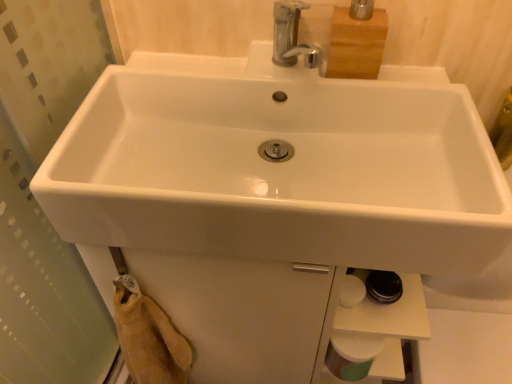
The image size is (512, 384). In order to click on white glossy sink at center in this screenshot , I will do [280, 172].

This screenshot has width=512, height=384. What do you see at coordinates (280, 172) in the screenshot? I see `white glossy sink at center` at bounding box center [280, 172].

The image size is (512, 384). I want to click on white matte toilet paper at lower right, so click(352, 356).

In order to face white matte toilet paper at lower right, should I rotate leftwards or rightwards?

A 12.710 degree turn to the right will do.

What do you see at coordinates (352, 356) in the screenshot? The width and height of the screenshot is (512, 384). I see `white matte toilet paper at lower right` at bounding box center [352, 356].

What is the approximate width of white matte toilet paper at lower right?

The width of white matte toilet paper at lower right is 3.39 inches.

Locate an element on the screen. white glossy sink at center is located at coordinates (280, 172).

Which object is positioned more to the right, white glossy sink at center or white matte toilet paper at lower right?

Positioned to the right is white matte toilet paper at lower right.

Which object is closer to the camera taking this photo, white glossy sink at center or white matte toilet paper at lower right?

white glossy sink at center is closer to the camera.

Considering the positions of points (222, 250) and (343, 335), is point (222, 250) farther from camera compared to point (343, 335)?

No, (222, 250) is in front of (343, 335).

From the image's perspective, relative to white matte toilet paper at lower right, is white glossy sink at center above or below?

white glossy sink at center is above white matte toilet paper at lower right.

From a real-world perspective, is white glossy sink at center positioned above or below white matte toilet paper at lower right?

From a real-world perspective, white glossy sink at center is physically above white matte toilet paper at lower right.

Does white glossy sink at center have a greater width compared to white matte toilet paper at lower right?

Indeed, white glossy sink at center has a greater width compared to white matte toilet paper at lower right.

Does white glossy sink at center have a greater height compared to white matte toilet paper at lower right?

Indeed, white glossy sink at center has a greater height compared to white matte toilet paper at lower right.

Considering the relative sizes of white glossy sink at center and white matte toilet paper at lower right in the image provided, is white glossy sink at center bigger than white matte toilet paper at lower right?

Yes, white glossy sink at center is bigger than white matte toilet paper at lower right.

Is white glossy sink at center not within white matte toilet paper at lower right?

Indeed, white glossy sink at center is completely outside white matte toilet paper at lower right.

Is there a large distance between white glossy sink at center and white matte toilet paper at lower right?

white glossy sink at center is near white matte toilet paper at lower right, not far away.

Could you tell me if white glossy sink at center is turned towards white matte toilet paper at lower right?

No, white glossy sink at center does not turn towards white matte toilet paper at lower right.

What's the angular difference between white glossy sink at center and white matte toilet paper at lower right's facing directions?

1.33 degrees.

I want to click on toilet paper on the right of white glossy sink at center, so click(352, 356).

In the image, is white matte toilet paper at lower right on the left side or the right side of white glossy sink at center?

From the image, it's evident that white matte toilet paper at lower right is to the right of white glossy sink at center.

Between white matte toilet paper at lower right and white glossy sink at center, which one is positioned in front?

white glossy sink at center is in front.

Does point (335, 339) come in front of point (379, 180)?

No, it is not.

From the image's perspective, is white matte toilet paper at lower right under white glossy sink at center?

Yes.

From a real-world perspective, does white matte toilet paper at lower right stand above white glossy sink at center?

No, from a real-world perspective, white matte toilet paper at lower right is not on top of white glossy sink at center.

Can you confirm if white matte toilet paper at lower right is wider than white glossy sink at center?

No, white matte toilet paper at lower right is not wider than white glossy sink at center.

Can you confirm if white matte toilet paper at lower right is taller than white glossy sink at center?

No.

Can you confirm if white matte toilet paper at lower right is smaller than white glossy sink at center?

Correct, white matte toilet paper at lower right occupies less space than white glossy sink at center.

Would you say white matte toilet paper at lower right contains white glossy sink at center?

That's incorrect, white glossy sink at center is not inside white matte toilet paper at lower right.

Is white matte toilet paper at lower right not close to white glossy sink at center?

white matte toilet paper at lower right is actually quite close to white glossy sink at center.

Could you tell me if white matte toilet paper at lower right is facing white glossy sink at center?

No.

What's the angular difference between white matte toilet paper at lower right and white glossy sink at center's facing directions?

The facing directions of white matte toilet paper at lower right and white glossy sink at center are 1.33 degrees apart.

Locate an element on the screen. The height and width of the screenshot is (384, 512). toilet paper located behind the white glossy sink at center is located at coordinates (352, 356).

The width and height of the screenshot is (512, 384). What are the coordinates of `sink that is in front of the white matte toilet paper at lower right` in the screenshot? It's located at coord(280,172).

This screenshot has width=512, height=384. I want to click on sink located above the white matte toilet paper at lower right (from the image's perspective), so click(280, 172).